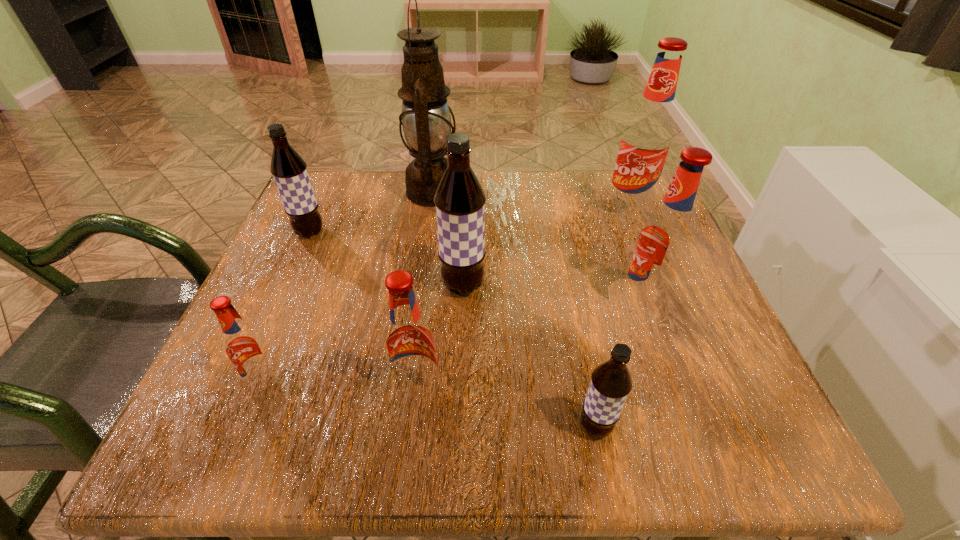
Find the location of a particular element. The height and width of the screenshot is (540, 960). the sixth object from left to right is located at coordinates (611, 382).

This screenshot has height=540, width=960. I want to click on the nearest brown root beer, so click(x=611, y=382).

Locate an element on the screen. The width and height of the screenshot is (960, 540). vacant space located on the left of the brown oil lamp is located at coordinates [327, 192].

Locate an element on the screen. vacant point located on the front of the biggest red root beer is located at coordinates (641, 243).

Find the location of a particular element. The width and height of the screenshot is (960, 540). free region located on the back of the second nearest brown root beer is located at coordinates (466, 233).

Where is `vacant position located on the left of the third smallest red root beer`? vacant position located on the left of the third smallest red root beer is located at coordinates (593, 302).

You are a GUI agent. You are given a task and a screenshot of the screen. Output one action in this format:
    pyautogui.click(x=<x>, y=<y>)
    Task: Click on the vacant space located on the left of the third red root beer from right to left
    
    Given the screenshot: What is the action you would take?
    pyautogui.click(x=304, y=392)

The height and width of the screenshot is (540, 960). Find the location of `free location located on the right of the leftmost brown root beer`. free location located on the right of the leftmost brown root beer is located at coordinates (423, 233).

Where is `free space located on the right of the leftmost red root beer`? This screenshot has width=960, height=540. free space located on the right of the leftmost red root beer is located at coordinates [313, 381].

Locate an element on the screen. The image size is (960, 540). vacant point located 0.190m on the left of the rightmost brown root beer is located at coordinates (444, 427).